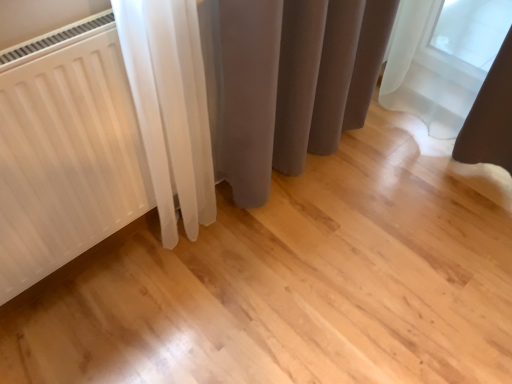
Where is `blank space above white matte radiator at left (from a real-world perspective)`? Image resolution: width=512 pixels, height=384 pixels. blank space above white matte radiator at left (from a real-world perspective) is located at coordinates (40, 44).